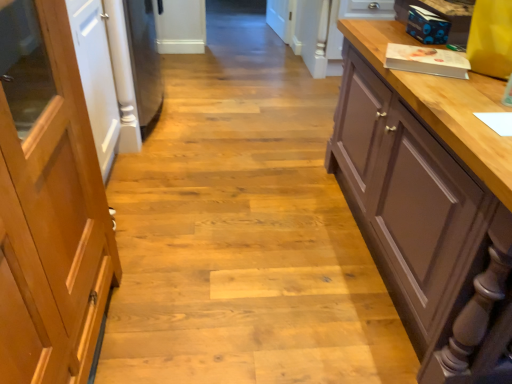
The height and width of the screenshot is (384, 512). Identify the location of vacant area on the back side of light brown wood door at left. (167, 246).